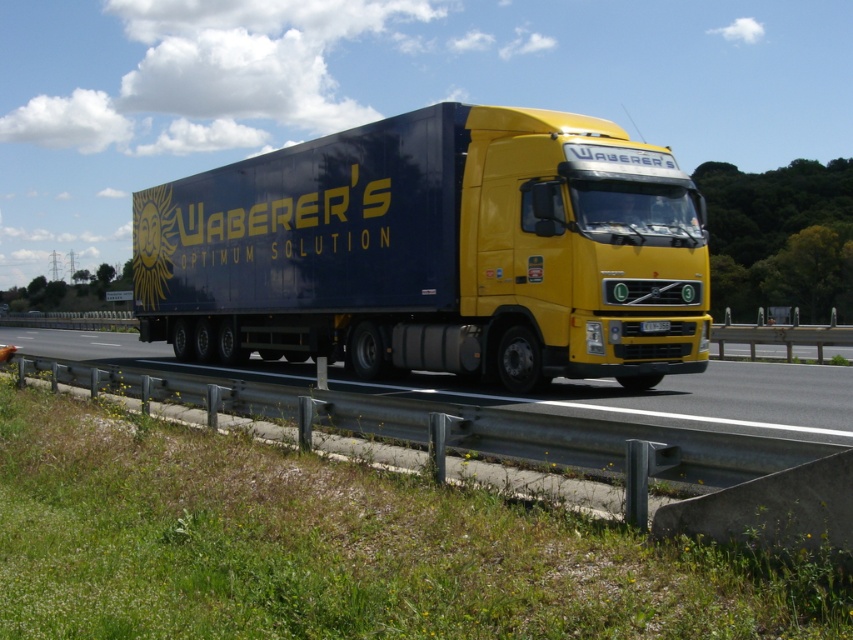
Question: Which point appears farthest from the camera in this image?

Choices:
 (A) (105, 356)
 (B) (439, 365)

Answer: (A)

Question: Can you confirm if matte black trailer truck at center is smaller than metallic gray highway at lower center?

Choices:
 (A) yes
 (B) no

Answer: (B)

Question: Is matte black trailer truck at center positioned in front of metallic gray highway at lower center?

Choices:
 (A) yes
 (B) no

Answer: (B)

Question: Is matte black trailer truck at center above metallic gray highway at lower center?

Choices:
 (A) no
 (B) yes

Answer: (B)